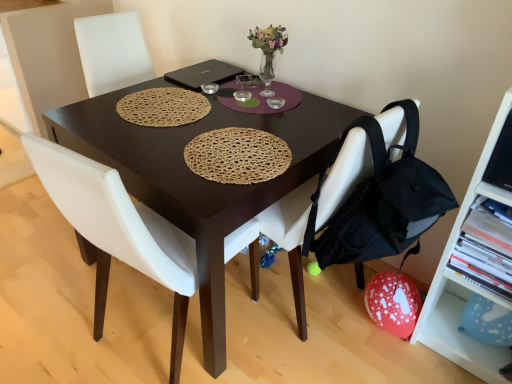
Where is `free space that is in between white plastic chair at center, acting as the 1th chair starting from the left, and dark brown wooden desk at center`? The image size is (512, 384). free space that is in between white plastic chair at center, acting as the 1th chair starting from the left, and dark brown wooden desk at center is located at coordinates (91, 306).